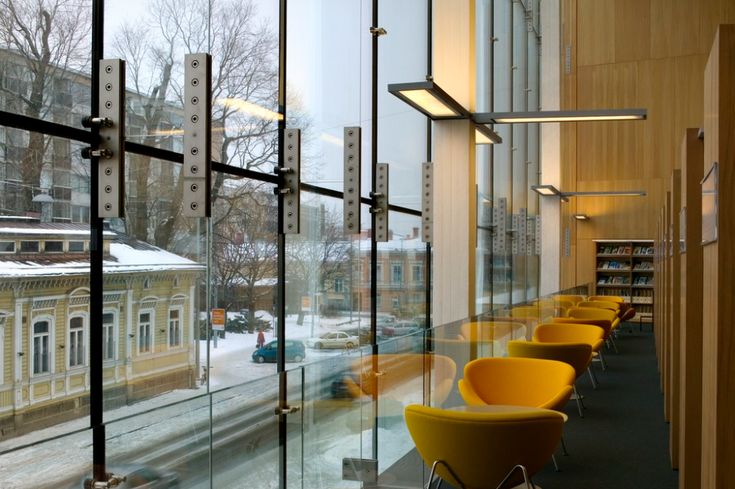
This screenshot has height=489, width=735. I want to click on overhead light, so click(434, 106), click(517, 119), click(484, 140), click(542, 187), click(589, 196), click(577, 221).